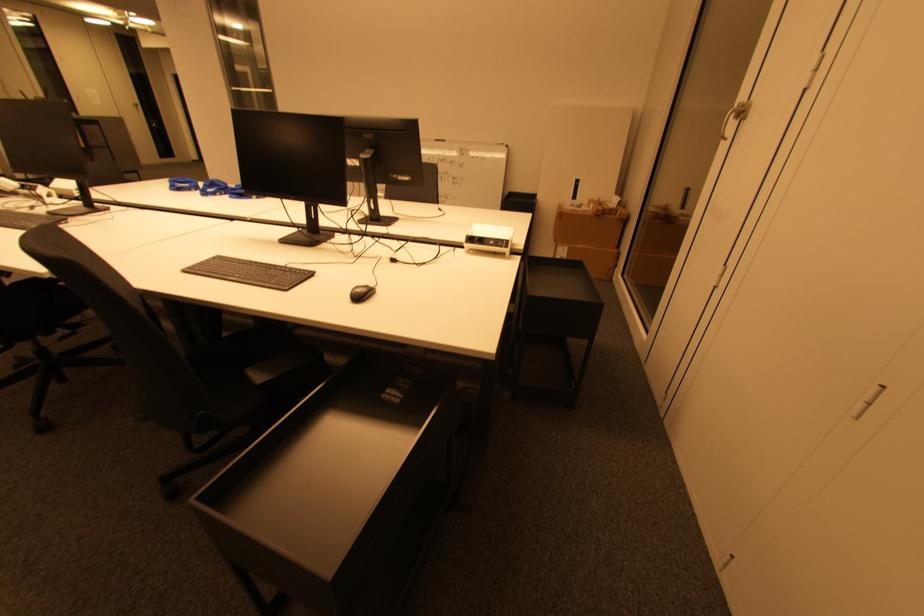
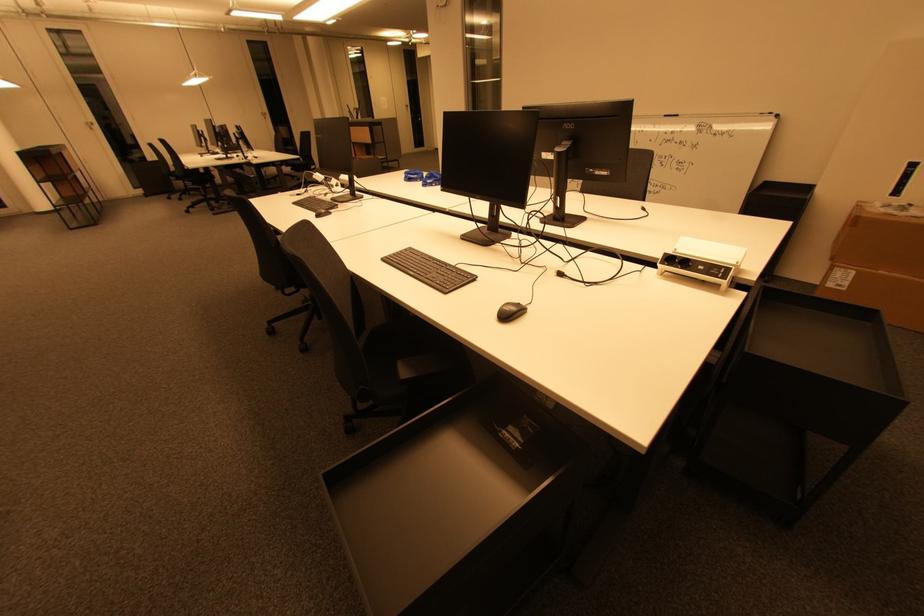
Question: The camera is either moving clockwise (left) or counter-clockwise (right) around the object. The first image is from the beginning of the video and the second image is from the end. Is the camera moving left or right when shooting the video?

Choices:
 (A) Left
 (B) Right

Answer: (B)